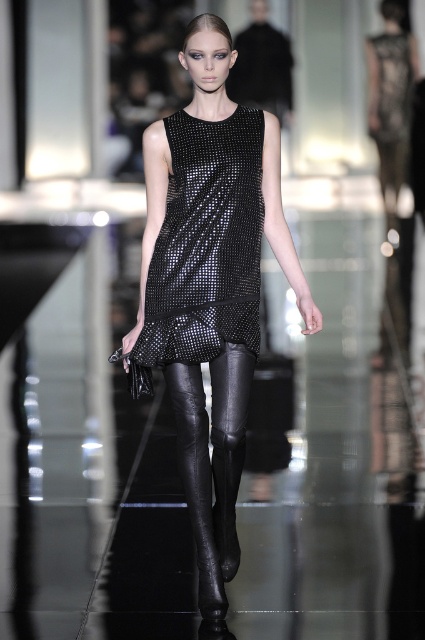
Question: Which of the following is the closest to the observer?

Choices:
 (A) shiny black dress at center
 (B) black sequined dress at center
 (C) black leather tights at center

Answer: (A)

Question: From the image, what is the correct spatial relationship of black sequined dress at center in relation to black leather tights at center?

Choices:
 (A) right
 (B) left

Answer: (B)

Question: Among these points, which one is nearest to the camera?

Choices:
 (A) (215, 566)
 (B) (221, 122)

Answer: (A)

Question: In this image, where is shiny black dress at center located relative to black leather tights at center?

Choices:
 (A) left
 (B) right

Answer: (B)

Question: Which of the following is the closest to the observer?

Choices:
 (A) black sequined dress at center
 (B) black leather tights at center
 (C) shiny black dress at center

Answer: (C)

Question: In this image, where is shiny black dress at center located relative to black leather tights at center?

Choices:
 (A) left
 (B) right

Answer: (B)